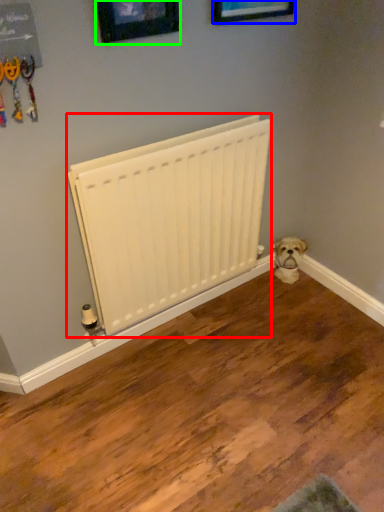
Question: Which object is the closest to the radiator (highlighted by a red box)? Choose among these: picture frame (highlighted by a blue box) or picture frame (highlighted by a green box).

Choices:
 (A) picture frame
 (B) picture frame

Answer: (B)